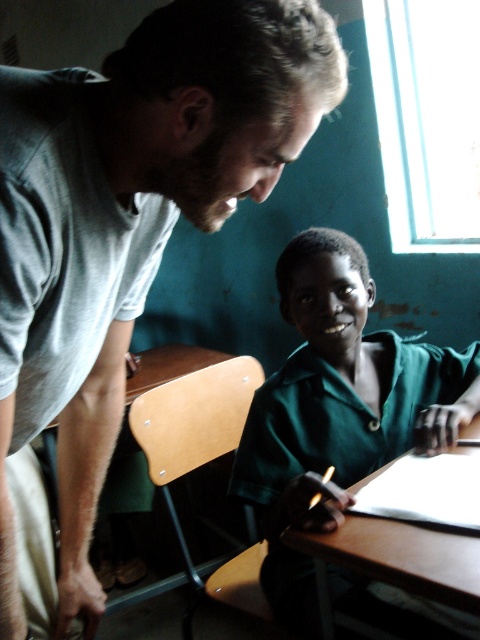
You are a student in the classroom and need to pass a pencil from the gray cotton shirt at upper left to the green matte uniform at center. Is the distance between them manageable for passing the pencil without moving from your current positions?

The gray cotton shirt at upper left and green matte uniform at center are 18.75 inches apart from each other, so yes, the distance is manageable for passing the pencil without needing to move from their current positions.

You are a student trying to reach the brown wooden table at lower center from your current position near the green matte uniform at center. Which direction should you move to get there?

The green matte uniform at center is to the right of the brown wooden table at lower center, so you should move to the left to reach the brown wooden table at lower center.

You are standing in the classroom and want to reach the point at coordinates (421, 628). If your arm can reach up to 2.5 feet, can you touch that point without moving your feet?

The distance of point (421, 628) from viewer is 3.39 feet, which is farther than your arm can reach. You cannot touch it without moving your feet.